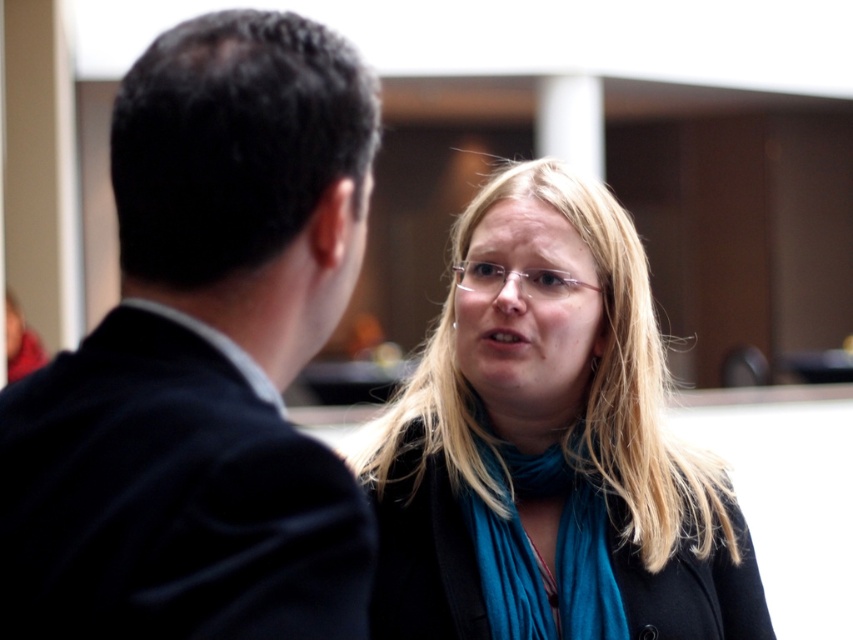
You are taking a photo of the black suit at left and the blue fabric scarf at center. Which object should you focus on first if you want both to be in sharp focus?

The black suit at left is closer to the viewer than the blue fabric scarf at center, so you should focus on the black suit at left first to ensure both are in sharp focus.